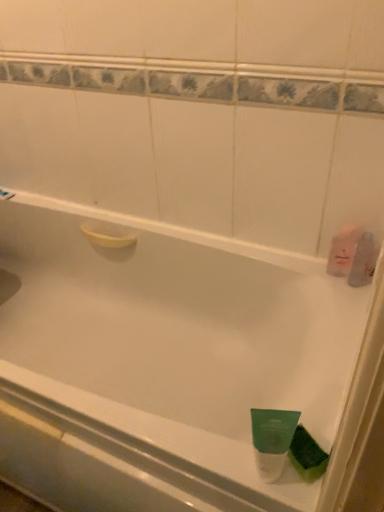
The width and height of the screenshot is (384, 512). Describe the element at coordinates (363, 261) in the screenshot. I see `clear plastic bottle at right, the fourth mouthwash viewed from the left` at that location.

How much space does pink translucent bottle at right, which ranks as the 1th mouthwash in back-to-front order, occupy vertically?

It is 15.19 centimeters.

Image resolution: width=384 pixels, height=512 pixels. What do you see at coordinates (272, 440) in the screenshot? I see `green matte tube at bottom right, arranged as the 4th mouthwash when viewed from the right` at bounding box center [272, 440].

What do you see at coordinates (307, 455) in the screenshot? The width and height of the screenshot is (384, 512). I see `green matte mouthwash at bottom right, the 4th mouthwash from the top` at bounding box center [307, 455].

At what (x,y) coordinates should I click in order to perform the action: click on green matte mouthwash at bottom right, which is the 2th mouthwash from front to back. Please return your answer as a coordinate pair (x, y). Looking at the image, I should click on (307, 455).

This screenshot has width=384, height=512. I want to click on white glossy shower at upper left, so click(6, 195).

The image size is (384, 512). In order to click on clear plastic bottle at right, the 3th mouthwash when ordered from front to back in this screenshot , I will do pos(363,261).

Is white glossy shower at upper left positioned beyond the bounds of green matte mouthwash at bottom right, marked as the third mouthwash in a back-to-front arrangement?

Yes, white glossy shower at upper left is not within green matte mouthwash at bottom right, marked as the third mouthwash in a back-to-front arrangement.

Relative to green matte mouthwash at bottom right, the first mouthwash when ordered from bottom to top, is white glossy shower at upper left in front or behind?

Visually, white glossy shower at upper left is located behind green matte mouthwash at bottom right, the first mouthwash when ordered from bottom to top.

Is white glossy shower at upper left in contact with green matte mouthwash at bottom right, the 2th mouthwash viewed from the left?

No, white glossy shower at upper left is not in contact with green matte mouthwash at bottom right, the 2th mouthwash viewed from the left.

Could you measure the distance between white glossy shower at upper left and green matte mouthwash at bottom right, the 2th mouthwash viewed from the left?

1.37 meters.

Is clear plastic bottle at right, the 2th mouthwash positioned from the top, next to green matte mouthwash at bottom right, marked as the third mouthwash in a back-to-front arrangement?

They are not placed beside each other.

From the image's perspective, which is above, clear plastic bottle at right, positioned as the 3th mouthwash in bottom-to-top order, or green matte mouthwash at bottom right, the first mouthwash when ordered from bottom to top?

clear plastic bottle at right, positioned as the 3th mouthwash in bottom-to-top order, appears higher in the image.

Does clear plastic bottle at right, positioned as the 3th mouthwash in bottom-to-top order, have a greater height compared to green matte mouthwash at bottom right, the first mouthwash when ordered from bottom to top?

Yes.

Considering the sizes of clear plastic bottle at right, the 2th mouthwash positioned from the top, and white glossy shower at upper left in the image, is clear plastic bottle at right, the 2th mouthwash positioned from the top, bigger or smaller than white glossy shower at upper left?

Considering their sizes, clear plastic bottle at right, the 2th mouthwash positioned from the top, takes up more space than white glossy shower at upper left.

Is clear plastic bottle at right, the 3th mouthwash when ordered from front to back, oriented away from white glossy shower at upper left?

clear plastic bottle at right, the 3th mouthwash when ordered from front to back, is not turned away from white glossy shower at upper left.

Can you confirm if clear plastic bottle at right, the fourth mouthwash viewed from the left, is wider than white glossy shower at upper left?

No, clear plastic bottle at right, the fourth mouthwash viewed from the left, is not wider than white glossy shower at upper left.

Which is nearer, (332, 264) or (364, 244)?

Point (364, 244)

From a real-world perspective, is pink translucent bottle at right, which is the fourth mouthwash from front to back, physically located above or below clear plastic bottle at right, the fourth mouthwash viewed from the left?

In terms of real-world spatial position, pink translucent bottle at right, which is the fourth mouthwash from front to back, is above clear plastic bottle at right, the fourth mouthwash viewed from the left.

Based on their sizes in the image, would you say pink translucent bottle at right, which is the 1th mouthwash in top-to-bottom order, is bigger or smaller than clear plastic bottle at right, positioned as the 3th mouthwash in bottom-to-top order?

pink translucent bottle at right, which is the 1th mouthwash in top-to-bottom order, is bigger than clear plastic bottle at right, positioned as the 3th mouthwash in bottom-to-top order.

Identify the location of the 1st mouthwash in front of the pink translucent bottle at right, which is the fourth mouthwash from front to back. Image resolution: width=384 pixels, height=512 pixels. (363, 261).

Between clear plastic bottle at right, the 2th mouthwash positioned from the top, and green matte tube at bottom right, placed as the first mouthwash when sorted from left to right, which one has smaller width?

green matte tube at bottom right, placed as the first mouthwash when sorted from left to right, is thinner.

In the image, is clear plastic bottle at right, the 1th mouthwash viewed from the right, positioned in front of or behind green matte tube at bottom right, placed as the first mouthwash when sorted from left to right?

clear plastic bottle at right, the 1th mouthwash viewed from the right, is positioned farther from the viewer than green matte tube at bottom right, placed as the first mouthwash when sorted from left to right.

From a real-world perspective, which is physically above, clear plastic bottle at right, the fourth mouthwash viewed from the left, or green matte tube at bottom right, placed as the first mouthwash when sorted from left to right?

In real-world perspective, green matte tube at bottom right, placed as the first mouthwash when sorted from left to right, is above.

Does clear plastic bottle at right, the 1th mouthwash viewed from the right, have a larger size compared to green matte tube at bottom right, which is the 2th mouthwash in bottom-to-top order?

Actually, clear plastic bottle at right, the 1th mouthwash viewed from the right, might be smaller than green matte tube at bottom right, which is the 2th mouthwash in bottom-to-top order.

Does pink translucent bottle at right, which ranks as the 1th mouthwash in back-to-front order, turn towards green matte mouthwash at bottom right, the first mouthwash when ordered from bottom to top?

Yes.

Which is more to the right, pink translucent bottle at right, which ranks as the 1th mouthwash in back-to-front order, or green matte mouthwash at bottom right, which is the 2th mouthwash from front to back?

pink translucent bottle at right, which ranks as the 1th mouthwash in back-to-front order.

Locate an element on the screen. This screenshot has width=384, height=512. the 2nd mouthwash directly beneath the pink translucent bottle at right, which is the third mouthwash from left to right (from a real-world perspective) is located at coordinates (x=307, y=455).

Does point (327, 265) appear closer or farther from the camera than point (314, 455)?

Point (327, 265) is farther from the camera than point (314, 455).

From the picture: Considering the positions of objects green matte mouthwash at bottom right, which is the 2th mouthwash from front to back, and pink translucent bottle at right, placed as the fourth mouthwash when sorted from bottom to top, in the image provided, who is more to the left, green matte mouthwash at bottom right, which is the 2th mouthwash from front to back, or pink translucent bottle at right, placed as the fourth mouthwash when sorted from bottom to top,?

green matte mouthwash at bottom right, which is the 2th mouthwash from front to back, is more to the left.

Considering the sizes of objects green matte mouthwash at bottom right, the 2th mouthwash viewed from the left, and pink translucent bottle at right, which is the third mouthwash from left to right, in the image provided, who is thinner, green matte mouthwash at bottom right, the 2th mouthwash viewed from the left, or pink translucent bottle at right, which is the third mouthwash from left to right,?

With smaller width is pink translucent bottle at right, which is the third mouthwash from left to right.

In terms of size, does green matte mouthwash at bottom right, marked as the third mouthwash in a back-to-front arrangement, appear bigger or smaller than pink translucent bottle at right, placed as the fourth mouthwash when sorted from bottom to top?

In the image, green matte mouthwash at bottom right, marked as the third mouthwash in a back-to-front arrangement, appears to be smaller than pink translucent bottle at right, placed as the fourth mouthwash when sorted from bottom to top.

Find the location of a particular element. The height and width of the screenshot is (512, 384). shower behind the green matte mouthwash at bottom right, which is the 3th mouthwash in right-to-left order is located at coordinates (6, 195).

Where is `mouthwash that is the 2nd one when counting downward from the clear plastic bottle at right, positioned as the 3th mouthwash in bottom-to-top order (from the image's perspective)`? Image resolution: width=384 pixels, height=512 pixels. mouthwash that is the 2nd one when counting downward from the clear plastic bottle at right, positioned as the 3th mouthwash in bottom-to-top order (from the image's perspective) is located at coordinates (307, 455).

When comparing their distances from green matte mouthwash at bottom right, the 2th mouthwash viewed from the left, does green matte tube at bottom right, which appears as the first mouthwash when viewed from the front, or clear plastic bottle at right, the 3th mouthwash when ordered from front to back, seem closer?

Based on the image, green matte tube at bottom right, which appears as the first mouthwash when viewed from the front, appears to be nearer to green matte mouthwash at bottom right, the 2th mouthwash viewed from the left.

Looking at the image, which one is located closer to green matte tube at bottom right, which appears as the first mouthwash when viewed from the front, white glossy shower at upper left or pink translucent bottle at right, which is the fourth mouthwash from front to back?

The object closer to green matte tube at bottom right, which appears as the first mouthwash when viewed from the front, is pink translucent bottle at right, which is the fourth mouthwash from front to back.

When comparing their distances from pink translucent bottle at right, placed as the fourth mouthwash when sorted from bottom to top, does white glossy shower at upper left or green matte tube at bottom right, which is the 3th mouthwash in top-to-bottom order, seem closer?

green matte tube at bottom right, which is the 3th mouthwash in top-to-bottom order, lies closer to pink translucent bottle at right, placed as the fourth mouthwash when sorted from bottom to top, than the other object.

When comparing their distances from green matte tube at bottom right, which appears as the first mouthwash when viewed from the front, does green matte mouthwash at bottom right, the first mouthwash when ordered from bottom to top, or pink translucent bottle at right, placed as the fourth mouthwash when sorted from bottom to top, seem further?

pink translucent bottle at right, placed as the fourth mouthwash when sorted from bottom to top, lies further to green matte tube at bottom right, which appears as the first mouthwash when viewed from the front, than the other object.

Considering their positions, is pink translucent bottle at right, placed as the fourth mouthwash when sorted from bottom to top, positioned further to clear plastic bottle at right, positioned as the 3th mouthwash in bottom-to-top order, than green matte tube at bottom right, which is the 3th mouthwash in top-to-bottom order?

Based on the image, green matte tube at bottom right, which is the 3th mouthwash in top-to-bottom order, appears to be further to clear plastic bottle at right, positioned as the 3th mouthwash in bottom-to-top order.

Based on their spatial positions, is white glossy shower at upper left or pink translucent bottle at right, which is the 1th mouthwash in top-to-bottom order, closer to clear plastic bottle at right, the fourth mouthwash viewed from the left?

pink translucent bottle at right, which is the 1th mouthwash in top-to-bottom order, is closer to clear plastic bottle at right, the fourth mouthwash viewed from the left.

Which object lies further to the anchor point green matte mouthwash at bottom right, the 4th mouthwash from the top, clear plastic bottle at right, the 3th mouthwash when ordered from front to back, or pink translucent bottle at right, placed as the fourth mouthwash when sorted from bottom to top?

pink translucent bottle at right, placed as the fourth mouthwash when sorted from bottom to top, is further to green matte mouthwash at bottom right, the 4th mouthwash from the top.

Based on their spatial positions, is clear plastic bottle at right, the fourth mouthwash viewed from the left, or white glossy shower at upper left closer to green matte mouthwash at bottom right, which is the 3th mouthwash in right-to-left order?

clear plastic bottle at right, the fourth mouthwash viewed from the left, lies closer to green matte mouthwash at bottom right, which is the 3th mouthwash in right-to-left order, than the other object.

Identify the location of mouthwash positioned between green matte mouthwash at bottom right, the 4th mouthwash from the top, and pink translucent bottle at right, which ranks as the 1th mouthwash in back-to-front order, from near to far. (363, 261).

Locate an element on the screen. This screenshot has height=512, width=384. mouthwash between green matte tube at bottom right, which ranks as the 4th mouthwash in back-to-front order, and clear plastic bottle at right, the 2th mouthwash positioned from the top, from front to back is located at coordinates (307, 455).